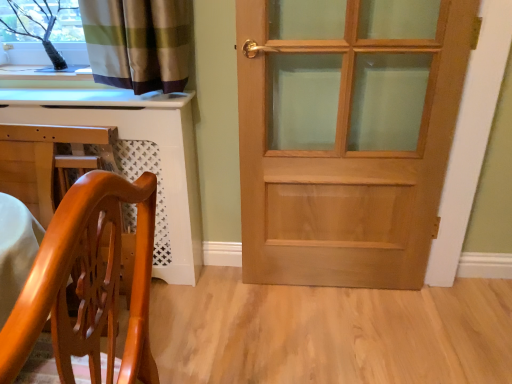
Question: Considering the relative positions of glossy wood chair at lower left and white glossy computer desk at lower left in the image provided, is glossy wood chair at lower left to the left or to the right of white glossy computer desk at lower left?

Choices:
 (A) right
 (B) left

Answer: (A)

Question: Is glossy wood chair at lower left taller or shorter than white glossy computer desk at lower left?

Choices:
 (A) tall
 (B) short

Answer: (B)

Question: Considering the real-world distances, which object is farthest from the white glossy computer desk at lower left?

Choices:
 (A) glossy wood chair at lower left
 (B) light brown wooden door at center

Answer: (A)

Question: Estimate the real-world distances between objects in this image. Which object is farther from the light brown wooden door at center?

Choices:
 (A) white glossy computer desk at lower left
 (B) glossy wood chair at lower left

Answer: (B)